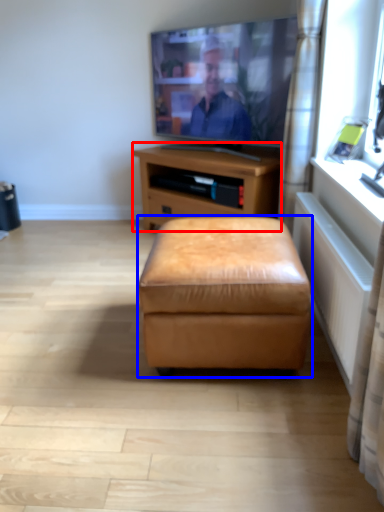
Question: Which point is closer to the camera, nightstand (highlighted by a red box) or stool (highlighted by a blue box)?

Choices:
 (A) nightstand
 (B) stool

Answer: (B)